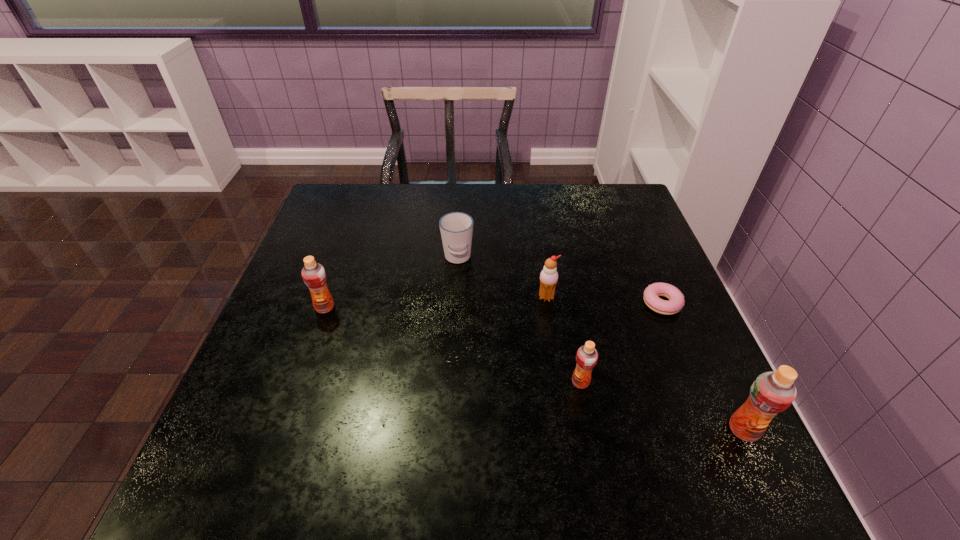
Locate an element on the screen. This screenshot has width=960, height=540. object at the near right corner is located at coordinates (771, 393).

Image resolution: width=960 pixels, height=540 pixels. Identify the location of vacant space at the far edge of the desktop. tap(519, 212).

Image resolution: width=960 pixels, height=540 pixels. What are the coordinates of `vacant space at the near edge of the desktop` in the screenshot? It's located at (556, 440).

Identify the location of vacant area at the left edge. (278, 305).

The height and width of the screenshot is (540, 960). I want to click on free space at the right edge of the desktop, so pos(697,397).

Locate an element on the screen. This screenshot has height=540, width=960. vacant space at the near left corner of the desktop is located at coordinates (296, 433).

The width and height of the screenshot is (960, 540). I want to click on free location at the far right corner of the desktop, so click(631, 206).

In order to click on empty space between the cup and the tallest orange juice in this screenshot , I will do click(x=601, y=344).

The width and height of the screenshot is (960, 540). What are the coordinates of `free space between the second object from left to right and the shortest object` in the screenshot? It's located at (560, 281).

The image size is (960, 540). What are the coordinates of `blank region between the second object from left to right and the tallest orange juice` in the screenshot? It's located at (601, 344).